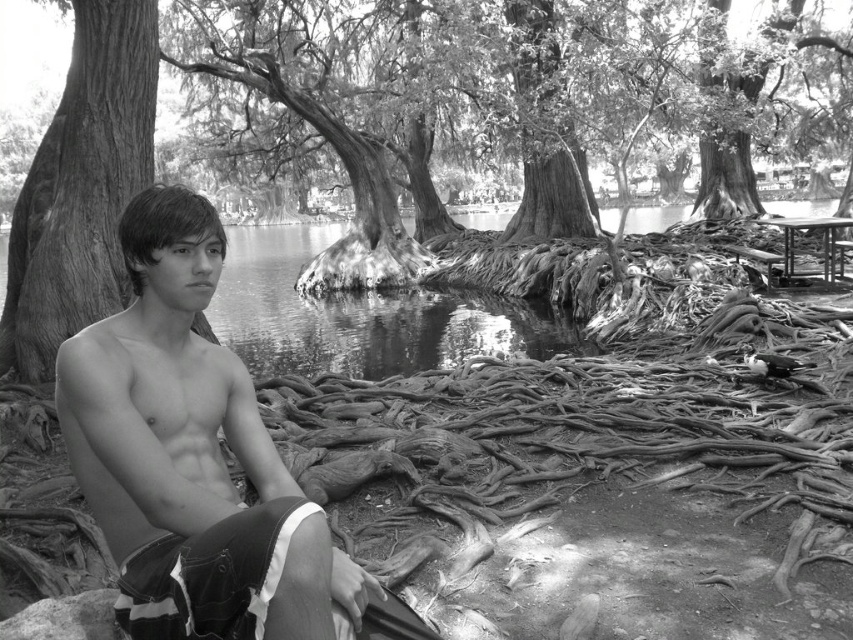
You are standing in the middle of the scene and want to move to the wooden picnic table at right. Which direction should you walk to avoid the rough bark tree at left?

Since the rough bark tree at left is positioned on the left side of the wooden picnic table at right, you should walk to the right side of the wooden picnic table at right to avoid the rough bark tree at left.

You are standing in the scene and want to reach the smooth bark tree trunk at left without stepping on the smooth denim shorts at center. Is this possible?

The smooth denim shorts at center are closer to the viewer than the smooth bark tree trunk at left, so you would have to step over or around the smooth denim shorts at center to reach the smooth bark tree trunk at left without stepping on them.

Based on the scene description and the position of the smooth denim shorts at center, can you determine if the shorts are closer to the foreground or background of the image?

The smooth denim shorts at center are located at point (x=170, y=413), which places them in the foreground of the image since lower y coordinates typically indicate closer proximity to the viewer in such coordinate systems.